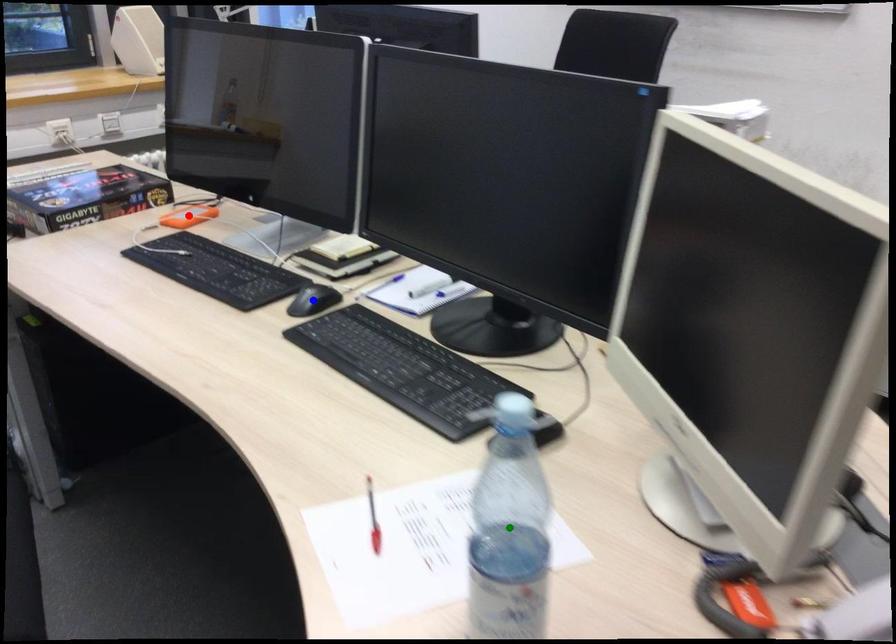
Order these from nearest to farthest:
1. red point
2. green point
3. blue point

1. red point
2. blue point
3. green point